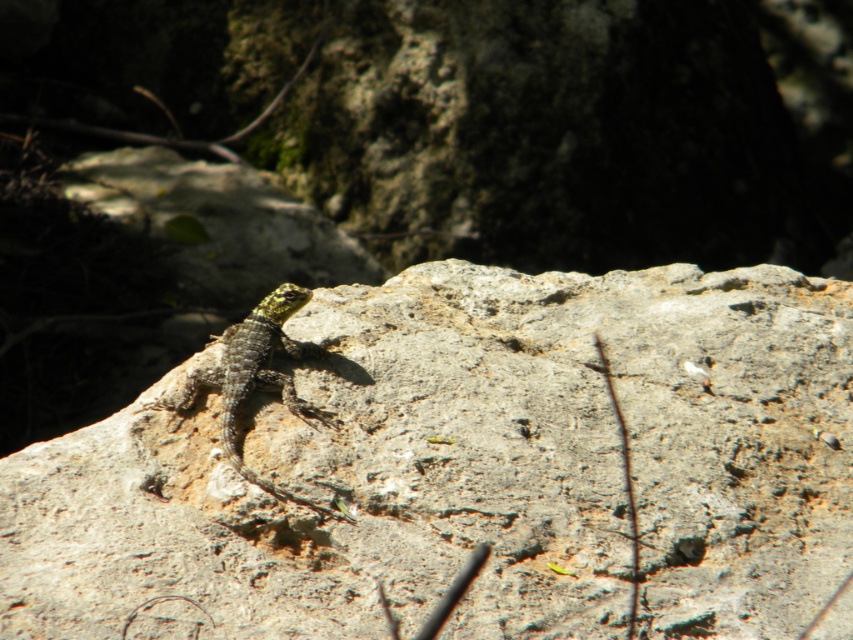
You are an observer looking at the scene. There is a gray rough rock at center and a green scaly lizard at center. Which object is positioned to the right of the other?

The gray rough rock at center is to the right of the green scaly lizard at center.

You are a photographer trying to capture the green scaly lizard at center. You notice the gray rough rock at center is blocking your view. Can you move the rock to get a clear shot of the lizard?

The gray rough rock at center is closer to the viewer than the green scaly lizard at center, so moving the rock would allow you to see the lizard clearly.

You are a nature photographer aiming to capture the green scaly lizard at center. You notice the gray rough rock at center in the background. Which object should you focus on to ensure the lizard is sharp and in focus?

You should focus on the green scaly lizard at center because it is smaller than the gray rough rock at center, making it easier to capture its details sharply.